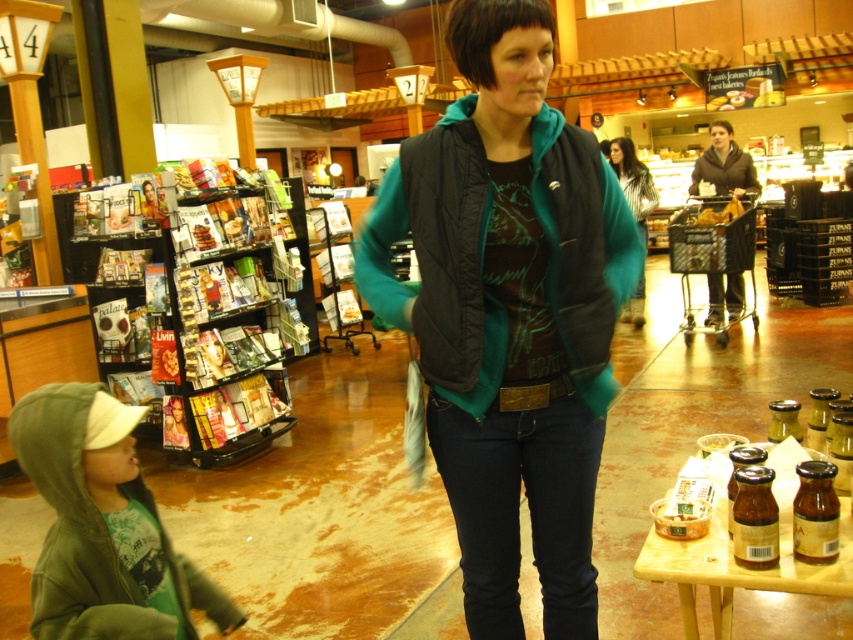
Can you confirm if black quilted vest at center is positioned to the right of metallic magazine rack at left?

Correct, you'll find black quilted vest at center to the right of metallic magazine rack at left.

Is point (567, 212) positioned before point (254, 232)?

Yes, it is in front of point (254, 232).

Where is `black quilted vest at center`? The width and height of the screenshot is (853, 640). black quilted vest at center is located at coordinates [439, 259].

Does black quilted vest at center appear under striped fabric shirt at center?

Indeed, black quilted vest at center is positioned under striped fabric shirt at center.

Find the location of `black quilted vest at center`. black quilted vest at center is located at coordinates (439, 259).

Does metallic magazine rack at left appear on the left side of green fleece hoodie at lower left?

Yes, metallic magazine rack at left is to the left of green fleece hoodie at lower left.

Is metallic magazine rack at left positioned before green fleece hoodie at lower left?

No, metallic magazine rack at left is behind green fleece hoodie at lower left.

Locate an element on the screen. metallic magazine rack at left is located at coordinates (213, 321).